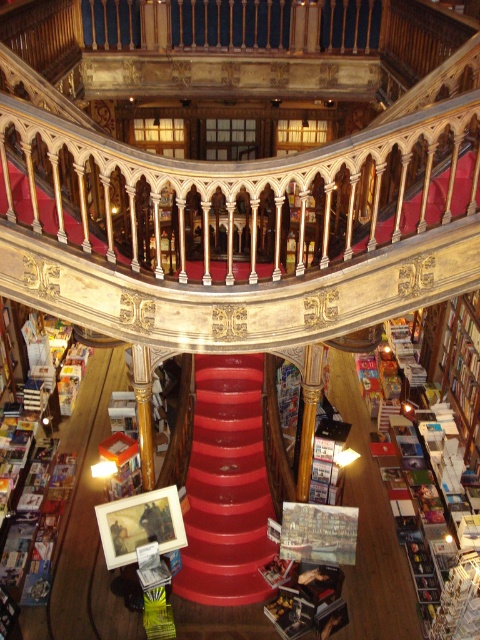
From the picture: Which is more to the left, smooth red staircase at center or hardcover book at center?

From the viewer's perspective, smooth red staircase at center appears more on the left side.

Who is lower down, smooth red staircase at center or hardcover book at center?

Positioned lower is hardcover book at center.

Is point (213, 493) positioned after point (305, 582)?

Yes, it is.

Where is `smooth red staircase at center`? This screenshot has width=480, height=640. smooth red staircase at center is located at coordinates (227, 486).